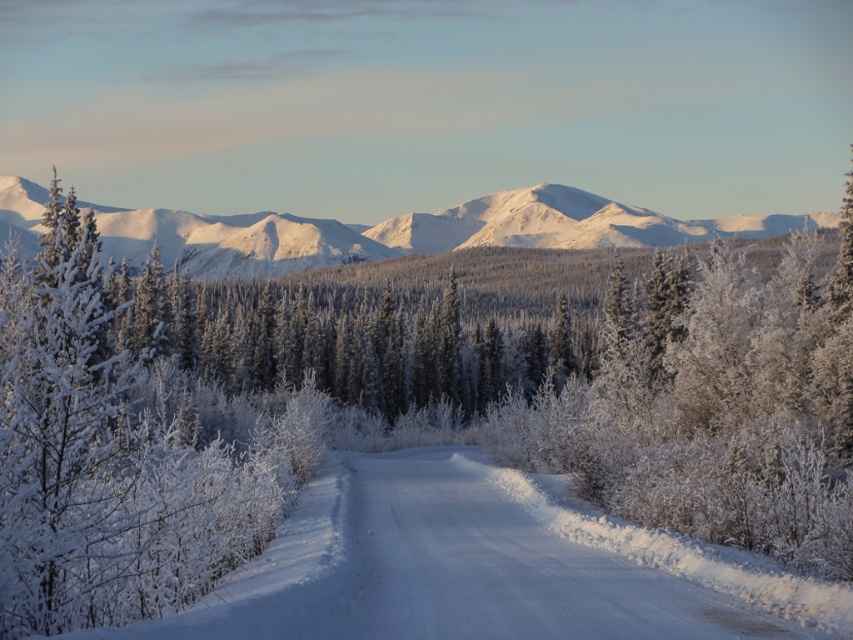
Can you confirm if white fluffy snow at center is thinner than white snow-covered mountain range at upper center?

Indeed, white fluffy snow at center has a lesser width compared to white snow-covered mountain range at upper center.

Describe the element at coordinates (486, 566) in the screenshot. I see `white fluffy snow at center` at that location.

Locate an element on the screen. This screenshot has width=853, height=640. white fluffy snow at center is located at coordinates (486, 566).

Where is `white fluffy snow at center`? Image resolution: width=853 pixels, height=640 pixels. white fluffy snow at center is located at coordinates (486, 566).

Can you confirm if white frosty tree at upper left is thinner than white fluffy snow at center?

No.

Looking at this image, can you confirm if white frosty tree at upper left is positioned below white fluffy snow at center?

No.

Which is behind, point (128, 284) or point (252, 627)?

Point (128, 284)

The width and height of the screenshot is (853, 640). I want to click on white frosty tree at upper left, so click(x=119, y=449).

Who is shorter, white frosty tree at upper left or white snow-covered mountain range at upper center?

white frosty tree at upper left is shorter.

Is point (216, 497) less distant than point (347, 253)?

Yes, point (216, 497) is in front of point (347, 253).

You are a GUI agent. You are given a task and a screenshot of the screen. Output one action in this format:
    pyautogui.click(x=<x>, y=<y>)
    Task: Click on the white frosty tree at upper left
    
    Given the screenshot: What is the action you would take?
    pyautogui.click(x=119, y=449)